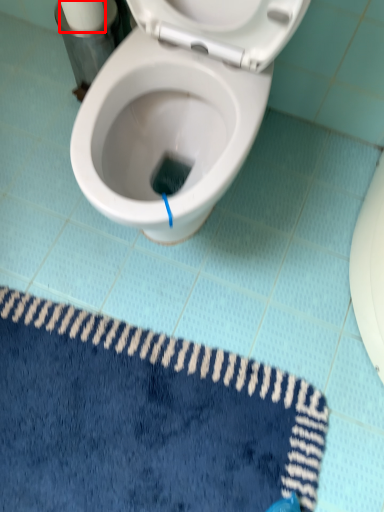
Question: Observing the image, what is the correct spatial positioning of toilet paper (annotated by the red box) in reference to bath mat?

Choices:
 (A) left
 (B) right

Answer: (A)